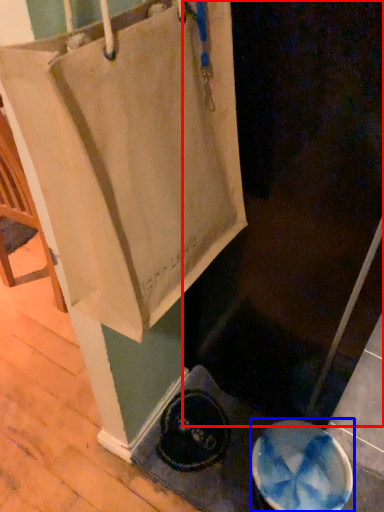
Question: Which object appears closest to the camera in this image, screen door (highlighted by a red box) or manhole cover (highlighted by a blue box)?

Choices:
 (A) screen door
 (B) manhole cover

Answer: (A)